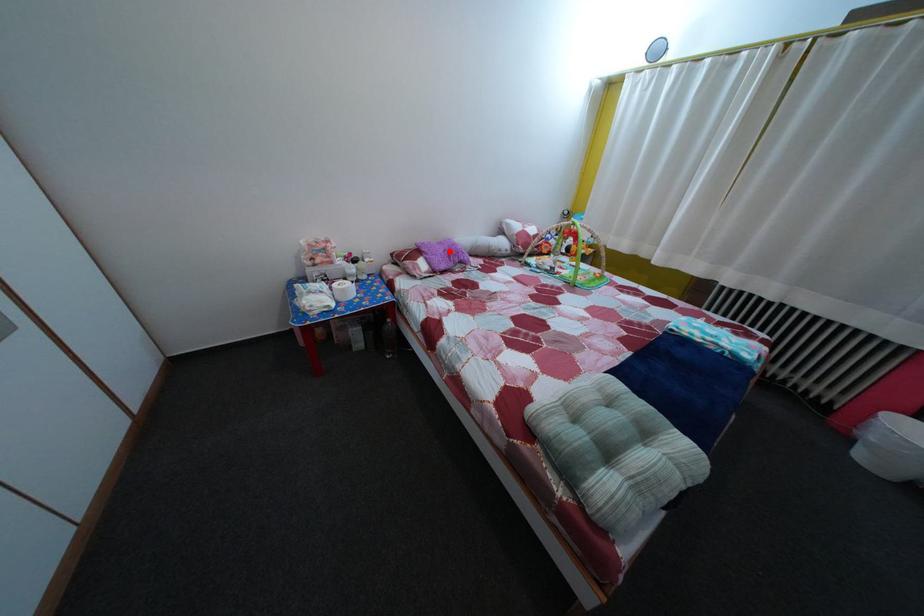
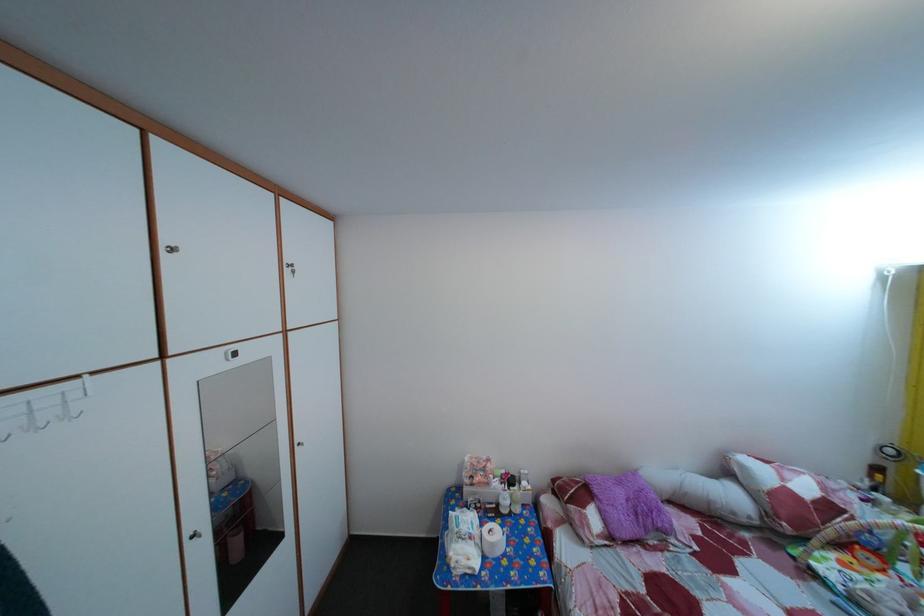
Question: I am providing you with two images of the same scene from different viewpoints. In image1, a red point is highlighted. Considering the same 3D point in image2, which of the following is correct?

Choices:
 (A) It is closer
 (B) It is farther

Answer: (B)